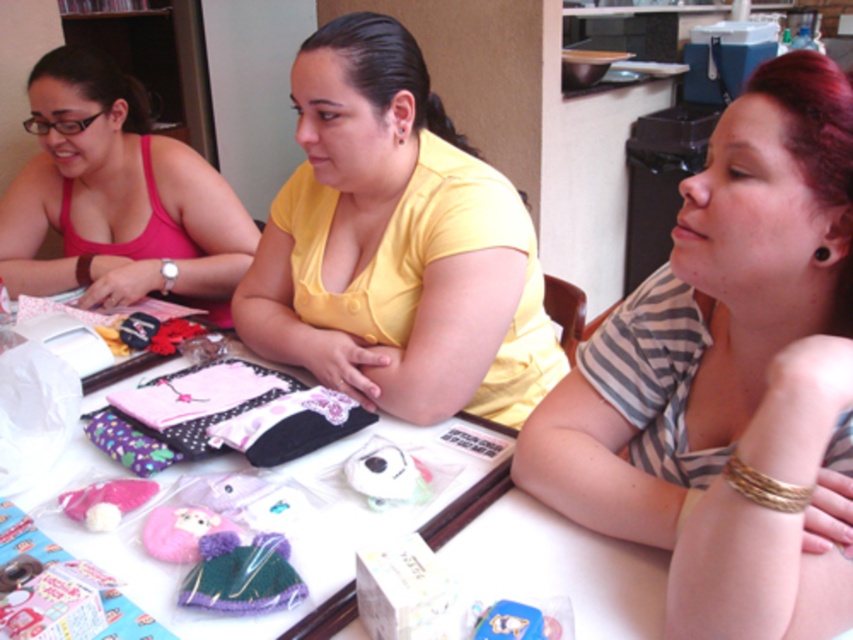
Can you confirm if gold metallic bracelet at lower right is wider than brown leather bracelet at upper left?

Yes.

Based on the photo, which is above, gold metallic bracelet at lower right or brown leather bracelet at upper left?

brown leather bracelet at upper left

Which is in front, point (798, 488) or point (84, 256)?

Point (798, 488) is more forward.

Image resolution: width=853 pixels, height=640 pixels. In order to click on gold metallic bracelet at lower right in this screenshot , I will do `click(764, 486)`.

Can you confirm if yellow matte shirt at center is positioned above silver metallic watch at upper left?

Yes.

This screenshot has height=640, width=853. Describe the element at coordinates (396, 244) in the screenshot. I see `yellow matte shirt at center` at that location.

The height and width of the screenshot is (640, 853). Find the location of `yellow matte shirt at center`. yellow matte shirt at center is located at coordinates (396, 244).

Between brown leather bracelet at upper left and black plastic earring at upper right, which one appears on the left side from the viewer's perspective?

From the viewer's perspective, brown leather bracelet at upper left appears more on the left side.

Does brown leather bracelet at upper left have a greater width compared to black plastic earring at upper right?

Yes, brown leather bracelet at upper left is wider than black plastic earring at upper right.

This screenshot has width=853, height=640. Identify the location of brown leather bracelet at upper left. (83, 268).

Find the location of a particular element. Image resolution: width=853 pixels, height=640 pixels. brown leather bracelet at upper left is located at coordinates (83, 268).